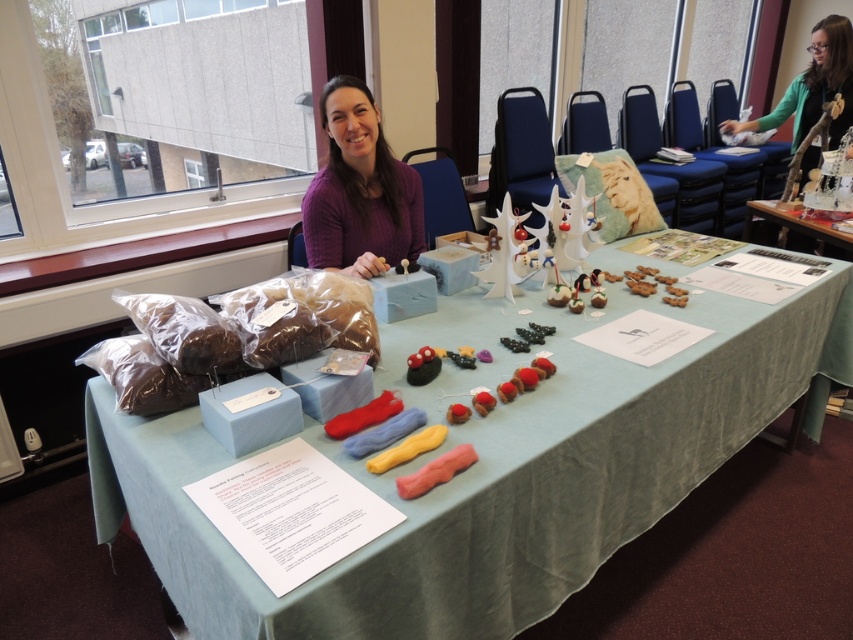
Question: Can you confirm if light blue fabric at center is positioned to the right of purple soft sweater at center?

Choices:
 (A) yes
 (B) no

Answer: (A)

Question: Can you confirm if purple soft sweater at center is wider than yellow fabric at center?

Choices:
 (A) no
 (B) yes

Answer: (B)

Question: Which point appears farthest from the camera in this image?

Choices:
 (A) 372,340
 (B) 386,256

Answer: (B)

Question: Which object appears closest to the camera in this image?

Choices:
 (A) yellow fabric at center
 (B) light blue fabric at center

Answer: (B)

Question: Does light blue fabric at center appear on the right side of purple soft sweater at center?

Choices:
 (A) yes
 (B) no

Answer: (A)

Question: Which object is positioned closest to the yellow fabric at center?

Choices:
 (A) light blue fabric at center
 (B) purple soft sweater at center

Answer: (A)